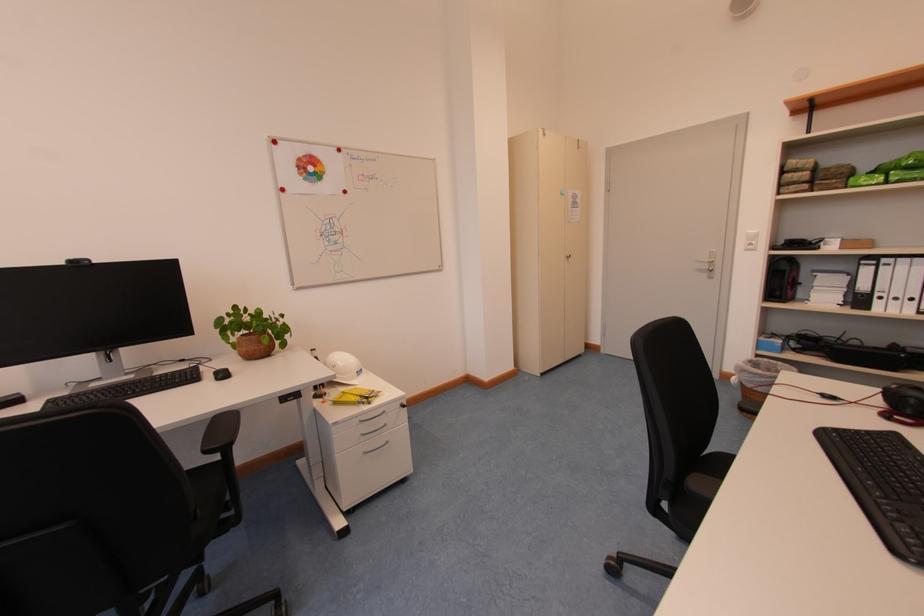
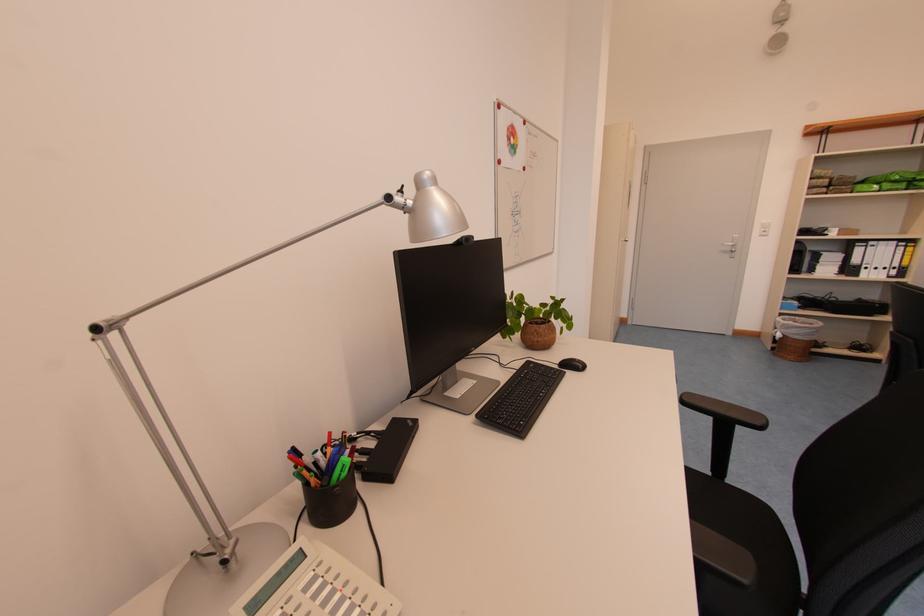
Question: I am providing you with two images of the same scene from different viewpoints. Please identify which objects are invisible in image2.

Choices:
 (A) red magnet
 (B) silver lamp head
 (C) silver door handle
 (D) none of these

Answer: (D)